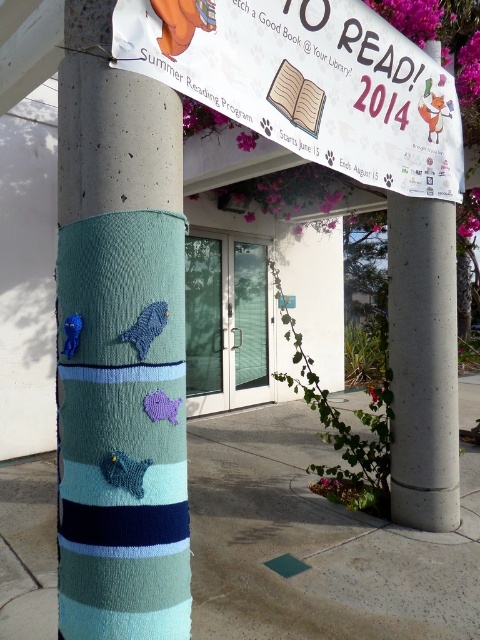
You are standing at the entrance of the library and see the teal knitted yarn at center and the concrete at right. Which object is positioned to the left of the other?

The teal knitted yarn at center is to the left of concrete at right.

You are designing a display for an art exhibition and need to choose between the teal knitted yarn at center and the white paper banner at upper center. If you want an item with a thinner appearance, which one should you select?

The teal knitted yarn at center is thinner than the white paper banner at upper center, so you should select the teal knitted yarn at center for a thinner appearance.

You are standing in front of the library entrance and want to place a small decorative item exactly at the center of the teal knitted yarn at center. According to the coordinates provided, what are the exact coordinates where you should place the item?

The exact coordinates for placing the decorative item at the center of the teal knitted yarn at center are point (119, 346).